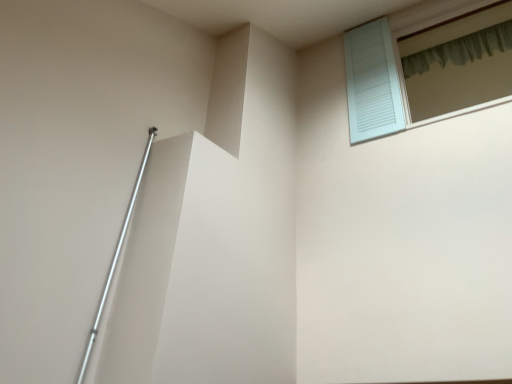
Question: From a real-world perspective, is light blue wooden window at upper right over green fabric shower curtain at upper right?

Choices:
 (A) no
 (B) yes

Answer: (A)

Question: Considering the relative sizes of light blue wooden window at upper right and green fabric shower curtain at upper right in the image provided, is light blue wooden window at upper right smaller than green fabric shower curtain at upper right?

Choices:
 (A) no
 (B) yes

Answer: (A)

Question: Does light blue wooden window at upper right appear on the left side of green fabric shower curtain at upper right?

Choices:
 (A) no
 (B) yes

Answer: (B)

Question: Considering the relative sizes of light blue wooden window at upper right and green fabric shower curtain at upper right in the image provided, is light blue wooden window at upper right thinner than green fabric shower curtain at upper right?

Choices:
 (A) yes
 (B) no

Answer: (B)

Question: From a real-world perspective, does light blue wooden window at upper right sit lower than green fabric shower curtain at upper right?

Choices:
 (A) yes
 (B) no

Answer: (A)

Question: Is light blue wooden window at upper right positioned before green fabric shower curtain at upper right?

Choices:
 (A) yes
 (B) no

Answer: (A)

Question: From a real-world perspective, is green fabric shower curtain at upper right positioned over light blue wooden window at upper right based on gravity?

Choices:
 (A) no
 (B) yes

Answer: (B)

Question: Is green fabric shower curtain at upper right shorter than light blue wooden window at upper right?

Choices:
 (A) no
 (B) yes

Answer: (B)

Question: From a real-world perspective, is green fabric shower curtain at upper right beneath light blue wooden window at upper right?

Choices:
 (A) no
 (B) yes

Answer: (A)

Question: Does green fabric shower curtain at upper right come behind light blue wooden window at upper right?

Choices:
 (A) yes
 (B) no

Answer: (A)

Question: Is green fabric shower curtain at upper right to the right of light blue wooden window at upper right from the viewer's perspective?

Choices:
 (A) no
 (B) yes

Answer: (B)

Question: Is green fabric shower curtain at upper right taller than light blue wooden window at upper right?

Choices:
 (A) no
 (B) yes

Answer: (A)

Question: Considering the positions of green fabric shower curtain at upper right and light blue wooden window at upper right in the image, is green fabric shower curtain at upper right bigger or smaller than light blue wooden window at upper right?

Choices:
 (A) small
 (B) big

Answer: (A)